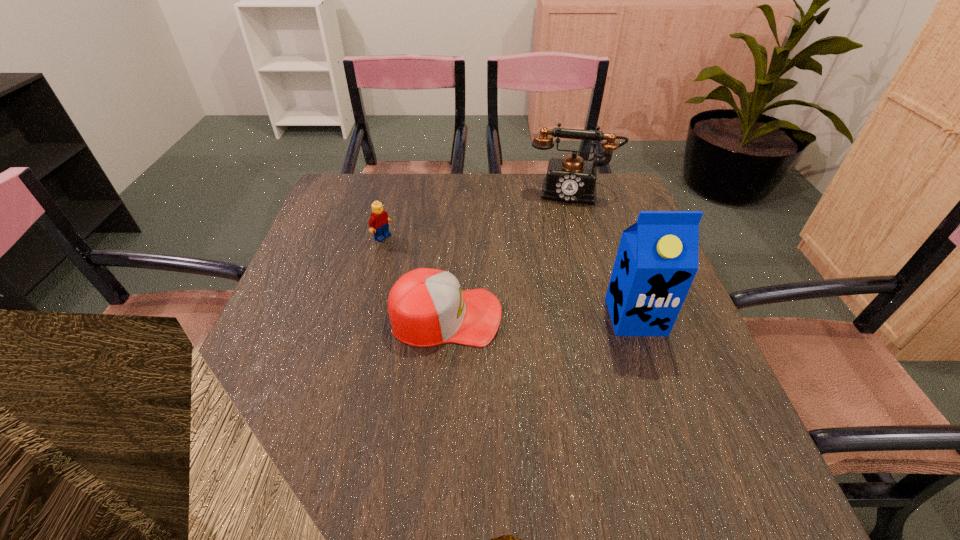
The image size is (960, 540). What are the coordinates of `vacant space that is in between the baseball cap and the second tallest object` in the screenshot? It's located at (509, 254).

Where is `free spot between the carton and the second object from left to right`? This screenshot has height=540, width=960. free spot between the carton and the second object from left to right is located at coordinates (540, 316).

Find the location of `free spot between the second farthest object and the farthest object`. free spot between the second farthest object and the farthest object is located at coordinates (477, 214).

Point out which object is positioned as the nearest to the second tallest object. Please provide its 2D coordinates. Your answer should be formatted as a tuple, i.e. [(x, y)], where the tuple contains the x and y coordinates of a point satisfying the conditions above.

[(427, 307)]

Choose which object is the second nearest neighbor to the baseball cap. Please provide its 2D coordinates. Your answer should be formatted as a tuple, i.e. [(x, y)], where the tuple contains the x and y coordinates of a point satisfying the conditions above.

[(657, 259)]